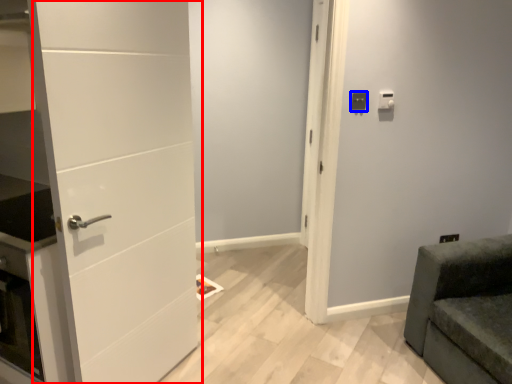
Question: Which object is further to the camera taking this photo, door (highlighted by a red box) or light switch (highlighted by a blue box)?

Choices:
 (A) door
 (B) light switch

Answer: (B)